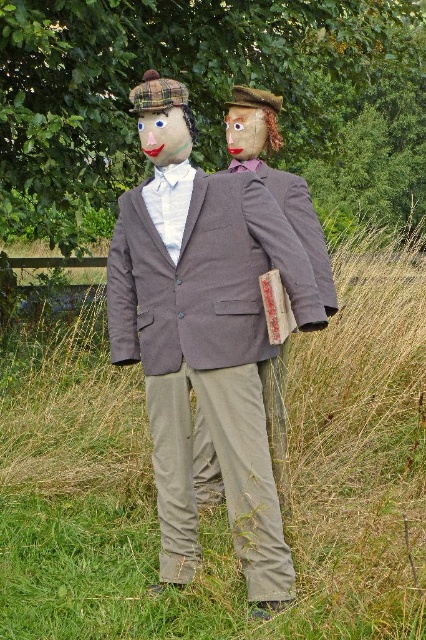
Question: Which is farther from the green grass at center?

Choices:
 (A) matte brown mask at center
 (B) matte brown suit at center
 (C) matte gray suit at center
 (D) matte fabric face at center

Answer: (D)

Question: Can you confirm if green grass at center is positioned to the left of matte gray suit at center?

Choices:
 (A) yes
 (B) no

Answer: (B)

Question: Which object appears closest to the camera in this image?

Choices:
 (A) matte fabric face at center
 (B) matte gray suit at center

Answer: (A)

Question: Which point is farther to the camera?

Choices:
 (A) (276, 579)
 (B) (348, 253)
 (C) (180, 129)

Answer: (B)

Question: Considering the relative positions of green grass at center and matte gray suit at center in the image provided, where is green grass at center located with respect to matte gray suit at center?

Choices:
 (A) above
 (B) below

Answer: (B)

Question: Is matte brown suit at center wider than matte fabric face at center?

Choices:
 (A) yes
 (B) no

Answer: (A)